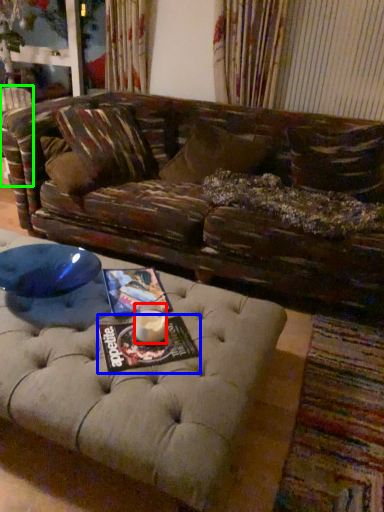
Question: Which object is positioned farthest from beverage (highlighted by a red box)? Select from magazine (highlighted by a blue box) and swivel chair (highlighted by a green box).

Choices:
 (A) magazine
 (B) swivel chair

Answer: (B)